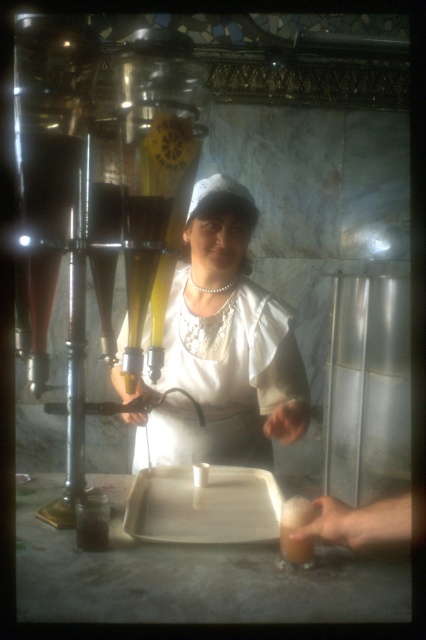
Can you confirm if white fabric apron at center is positioned to the left of translucent glass drink at lower center?

Indeed, white fabric apron at center is positioned on the left side of translucent glass drink at lower center.

Describe the element at coordinates (222, 348) in the screenshot. I see `white fabric apron at center` at that location.

Locate an element on the screen. The image size is (426, 640). white fabric apron at center is located at coordinates (222, 348).